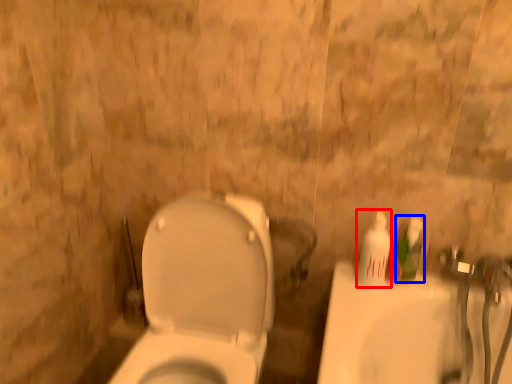
Question: Which object is further to the camera taking this photo, mouthwash (highlighted by a red box) or mouthwash (highlighted by a blue box)?

Choices:
 (A) mouthwash
 (B) mouthwash

Answer: (B)